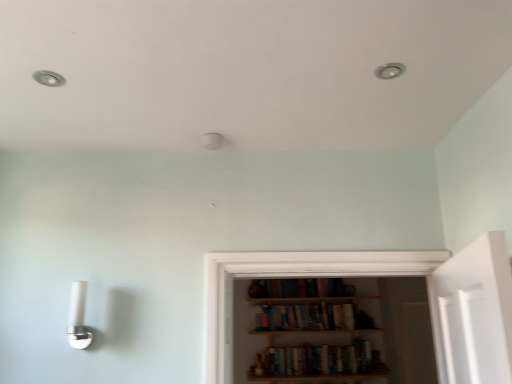
Question: Considering the positions of point (39, 69) and point (367, 345), is point (39, 69) closer or farther from the camera than point (367, 345)?

Choices:
 (A) farther
 (B) closer

Answer: (B)

Question: In the image, is matte white light fixture at upper left positioned in front of or behind hardcover books at center, the 1th book ordered from the bottom?

Choices:
 (A) front
 (B) behind

Answer: (A)

Question: Estimate the real-world distances between objects in this image. Which object is farther from the hardcover books at center, the 2th book when ordered from bottom to top?

Choices:
 (A) matte white light fixture at upper left
 (B) white glossy sconce at lower left
 (C) hardcover books at center, the 1th book ordered from the bottom

Answer: (A)

Question: Estimate the real-world distances between objects in this image. Which object is closer to the hardcover books at center, the 1th book ordered from the bottom?

Choices:
 (A) hardcover books at center, placed as the first book when sorted from top to bottom
 (B) white glossy sconce at lower left
 (C) matte white light fixture at upper left

Answer: (A)